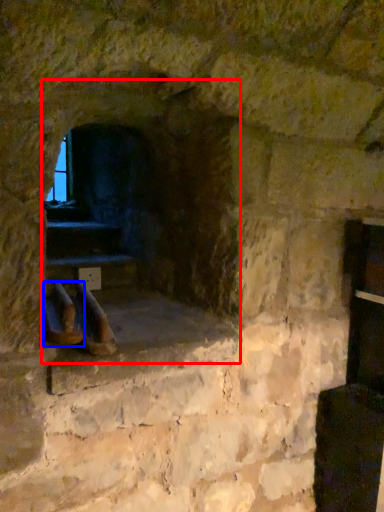
Question: Which of the following is the farthest to the observer, fireplace (highlighted by a red box) or footwear (highlighted by a blue box)?

Choices:
 (A) fireplace
 (B) footwear

Answer: (A)